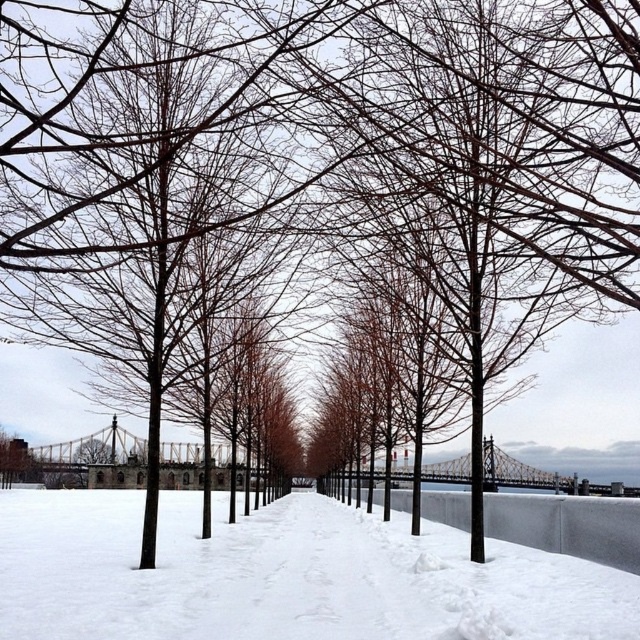
Is brown matte tree at center to the right of white snow at center from the viewer's perspective?

Yes, brown matte tree at center is to the right of white snow at center.

This screenshot has height=640, width=640. What are the coordinates of `brown matte tree at center` in the screenshot? It's located at (499, 164).